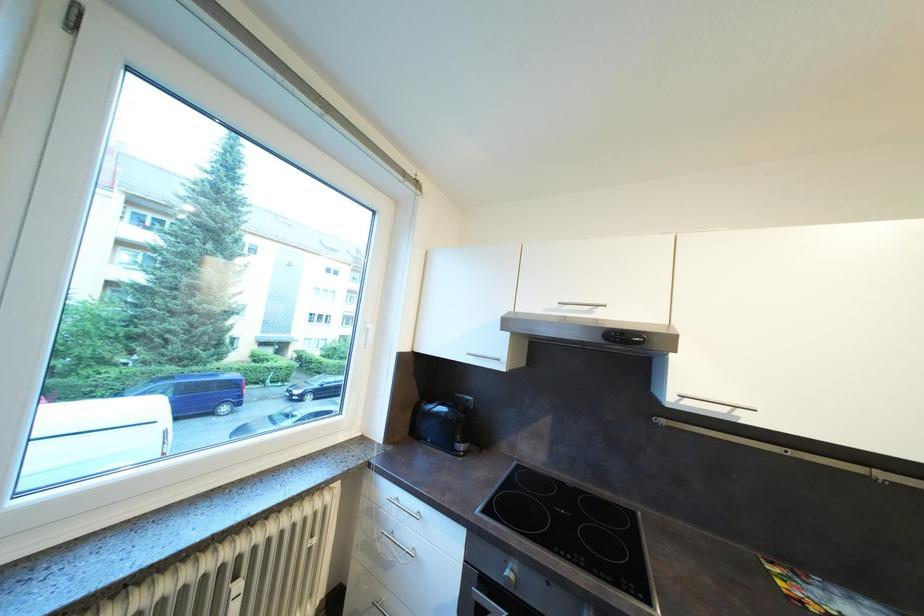
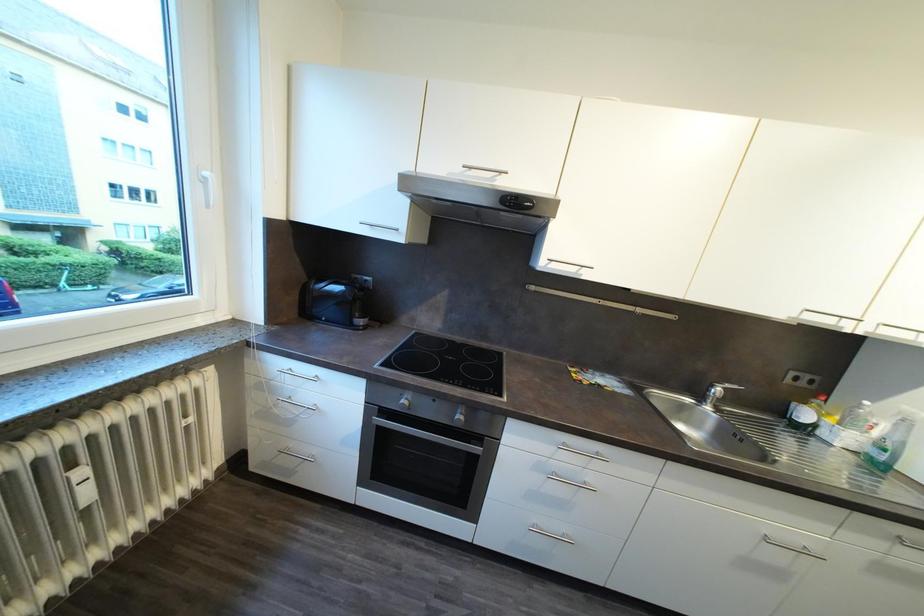
Based on the continuous images, in which direction is the camera rotating?

The rotation direction of the camera is right-down.